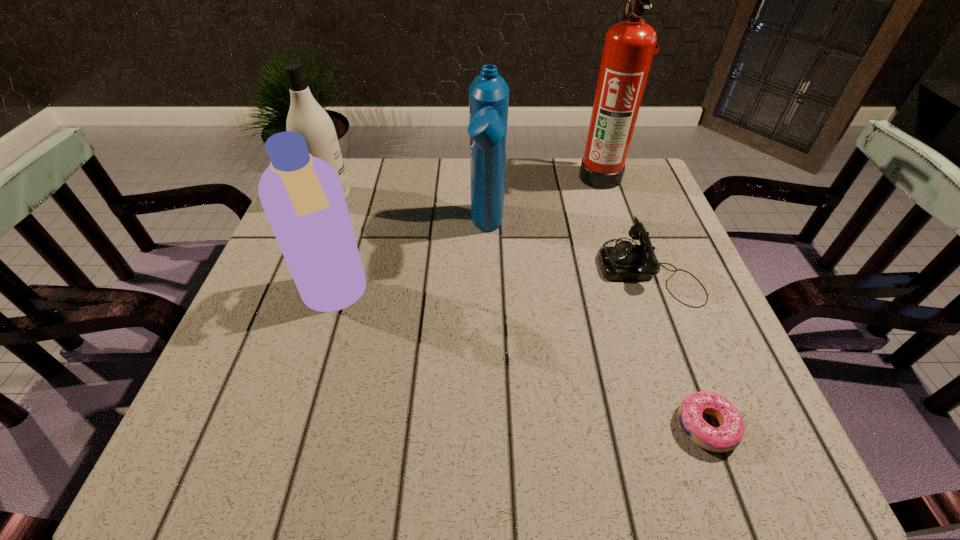
Identify the location of the tallest object. The width and height of the screenshot is (960, 540). (629, 46).

The height and width of the screenshot is (540, 960). What are the coordinates of `the rightmost shampoo` in the screenshot? It's located at (488, 93).

Identify the location of the nearest shampoo. The height and width of the screenshot is (540, 960). (302, 196).

Identify the location of telephone. tap(625, 261).

Where is `the nearest object`? This screenshot has width=960, height=540. the nearest object is located at coordinates (728, 436).

I want to click on the shortest object, so click(728, 436).

Where is `vacant space located with the nozzle pointing from the back of the tallest object`? This screenshot has height=540, width=960. vacant space located with the nozzle pointing from the back of the tallest object is located at coordinates (553, 177).

At what (x,y) coordinates should I click in order to perform the action: click on free location located with the nozzle pointing from the back of the tallest object. Please return your answer as a coordinate pair (x, y). The width and height of the screenshot is (960, 540). Looking at the image, I should click on (553, 177).

The width and height of the screenshot is (960, 540). I want to click on vacant region located 0.300m with the nozzle pointing from the back of the tallest object, so click(x=469, y=177).

Locate an element on the screen. The height and width of the screenshot is (540, 960). free space located on the right of the rightmost shampoo is located at coordinates (635, 230).